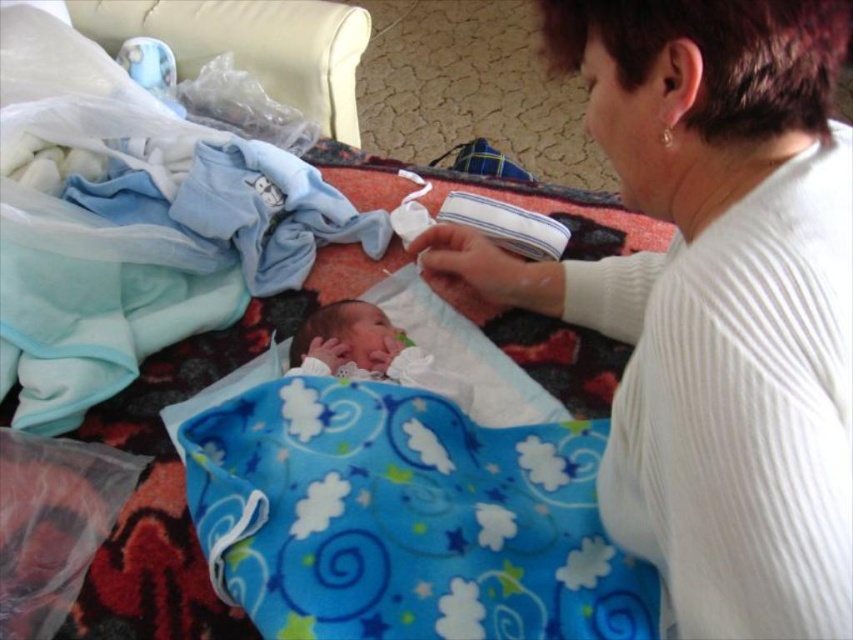
Question: Is white ribbed sweater at upper right positioned before blue fleece blanket at center?

Choices:
 (A) no
 (B) yes

Answer: (B)

Question: Which of the following is the farthest from the observer?

Choices:
 (A) white ribbed sweater at upper right
 (B) soft white swaddling blanket at center
 (C) blue fleece blanket at center
 (D) soft white newborn at center

Answer: (D)

Question: Which point is closer to the camera?

Choices:
 (A) (277, 460)
 (B) (849, 141)
 (C) (393, 356)

Answer: (B)

Question: Is blue fleece blanket at center thinner than soft white newborn at center?

Choices:
 (A) no
 (B) yes

Answer: (A)

Question: Which point is closer to the camera taking this photo?

Choices:
 (A) (396, 380)
 (B) (361, 339)

Answer: (A)

Question: Is blue fleece blanket at center wider than soft white swaddling blanket at center?

Choices:
 (A) yes
 (B) no

Answer: (A)